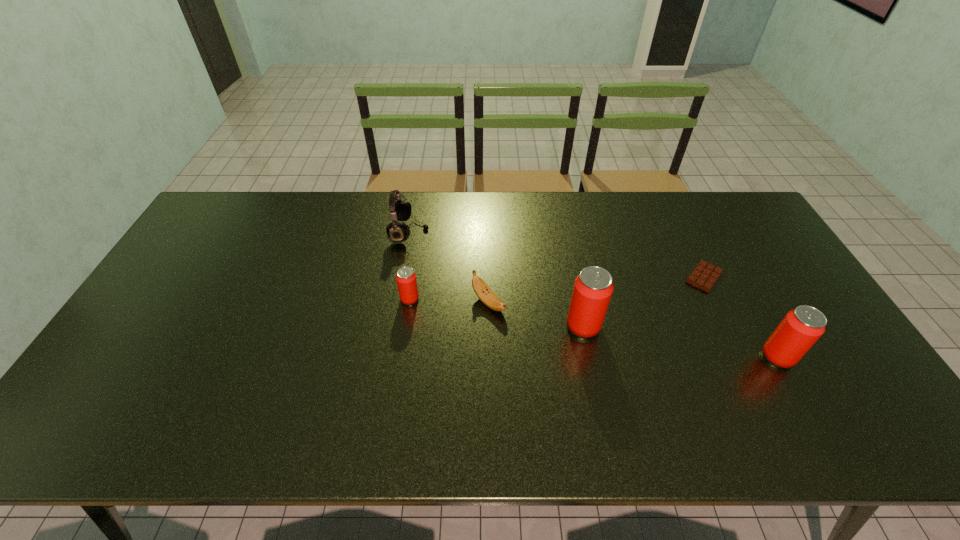
The beer cans are evenly distributed in the image. To maintain this, where would you place another beer can on the left? Please point to a free space. Please provide its 2D coordinates. Your answer should be formatted as a tuple, i.e. [(x, y)], where the tuple contains the x and y coordinates of a point satisfying the conditions above.

[(253, 275)]